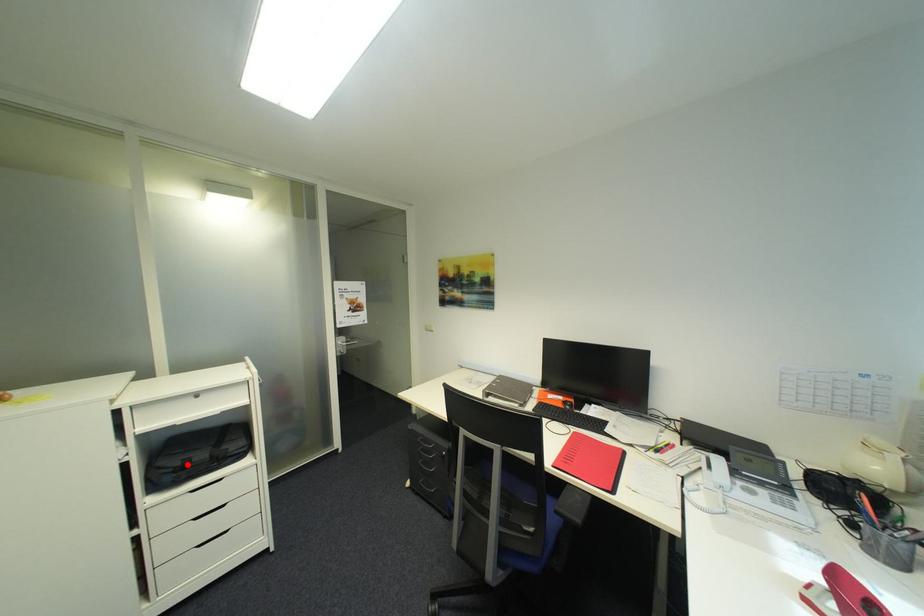
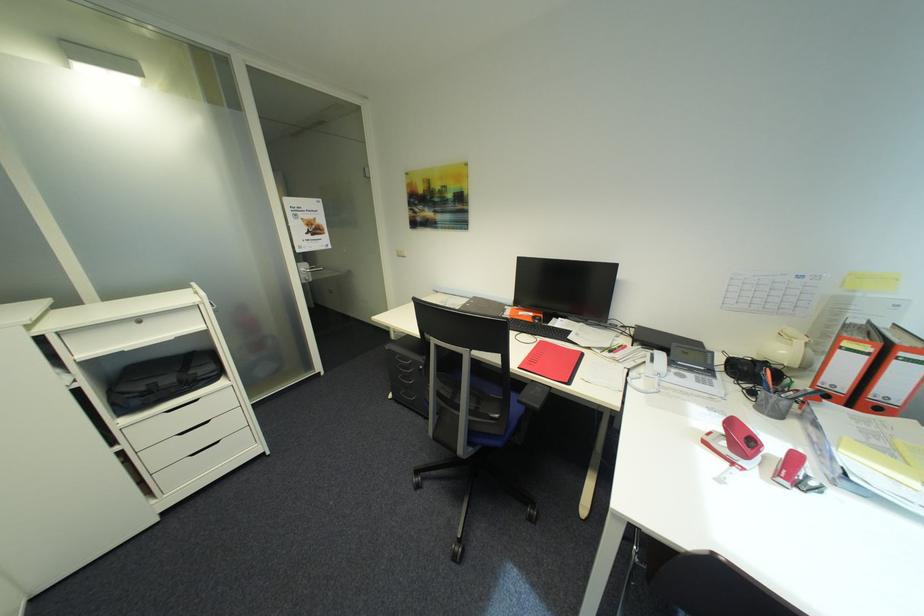
Find the pixel in the second image that matches the highlighted location in the first image.

(152, 389)